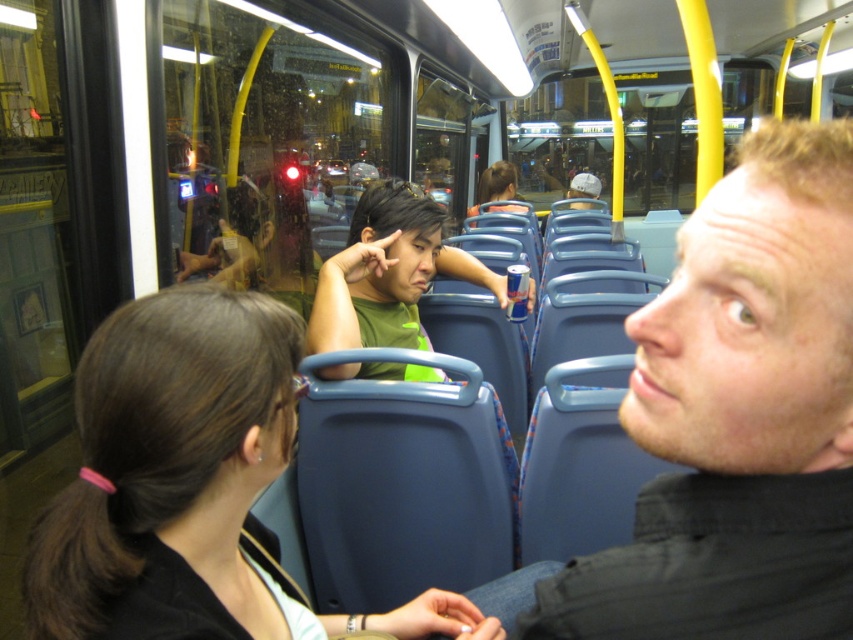
Which of these two, brown hair at center or matte green shirt at center, stands taller?

Standing taller between the two is matte green shirt at center.

Which is in front, point (206, 529) or point (514, 176)?

Point (206, 529)

Between point (30, 632) and point (494, 180), which one is positioned in front?

Positioned in front is point (30, 632).

In order to click on brown hair at center in this screenshot , I will do `click(169, 472)`.

Who is lower down, smooth black shirt at center or matte green shirt at center?

Answer: smooth black shirt at center

Between smooth black shirt at center and matte green shirt at center, which one has less height?

Standing shorter between the two is smooth black shirt at center.

Is point (790, 608) farther from camera compared to point (503, 180)?

No, it is not.

The width and height of the screenshot is (853, 640). I want to click on smooth black shirt at center, so click(x=738, y=417).

Based on the photo, is green matte shirt at center shorter than matte green shirt at center?

Incorrect, green matte shirt at center's height does not fall short of matte green shirt at center's.

Between green matte shirt at center and matte green shirt at center, which one has more height?

With more height is green matte shirt at center.

Identify the location of green matte shirt at center. This screenshot has height=640, width=853. (387, 273).